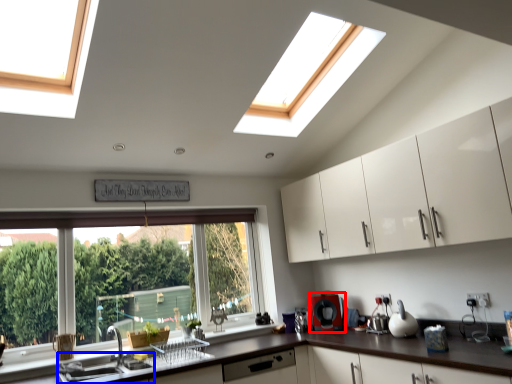
Question: Which object is closer to the camera taking this photo, appliance (highlighted by a red box) or sink (highlighted by a blue box)?

Choices:
 (A) appliance
 (B) sink

Answer: (B)